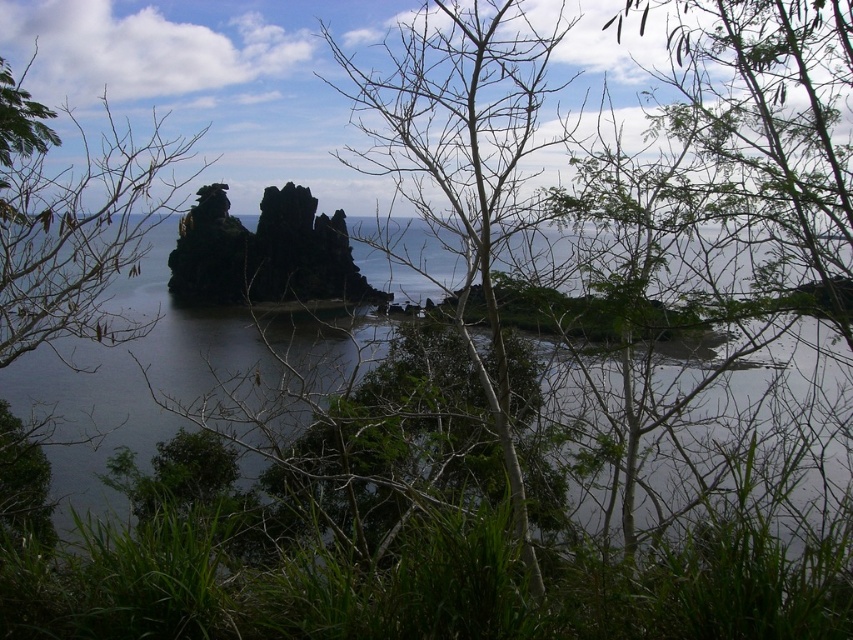
You are an artist setting up an easel to paint the coastal scene. You notice the bare branches at center and the brown leafless branches at upper left. Which set of branches is closer to the water below?

The bare branches at center is positioned under brown leafless branches at upper left, so the bare branches at center are closer to the water below.

You are standing at a coastal viewpoint where you can see two points marked on the scene. The first point is at coordinates point (15, 369) and the second is at point (115, 154). If you were to walk directly towards the rocky outcrop, which point would you encounter first?

Point (15, 369) is further to the viewer than point (115, 154), so you would encounter point (15, 369) first as you walk towards the rocky outcrop.